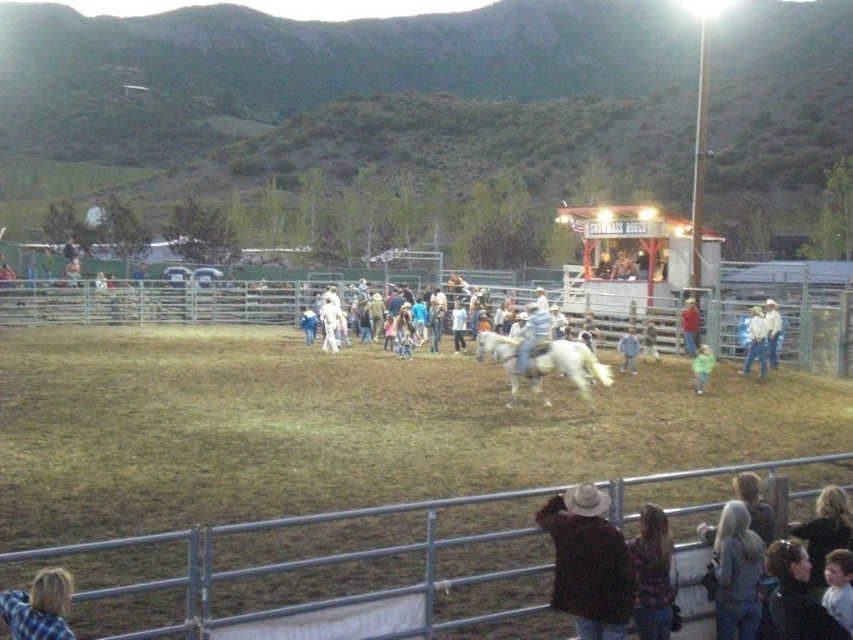
Question: Which point is farther from the camera taking this photo?

Choices:
 (A) (836, 552)
 (B) (543, 506)

Answer: (B)

Question: Considering the real-world distances, which object is closest to the green matte shirt at lower center?

Choices:
 (A) white glossy horse at center
 (B) metallic silver fence at lower center
 (C) metallic silver fence at center

Answer: (A)

Question: Is plaid shirt at lower right further to camera compared to plaid shirt at lower left?

Choices:
 (A) no
 (B) yes

Answer: (B)

Question: Is the position of plaid shirt at lower left less distant than that of light blue denim jeans at center?

Choices:
 (A) yes
 (B) no

Answer: (A)

Question: Which point appears farthest from the camera in this image?

Choices:
 (A) (520, 340)
 (B) (692, 326)
 (C) (585, 561)

Answer: (B)

Question: Does metallic silver fence at lower center have a greater width compared to green matte shirt at lower center?

Choices:
 (A) no
 (B) yes

Answer: (A)